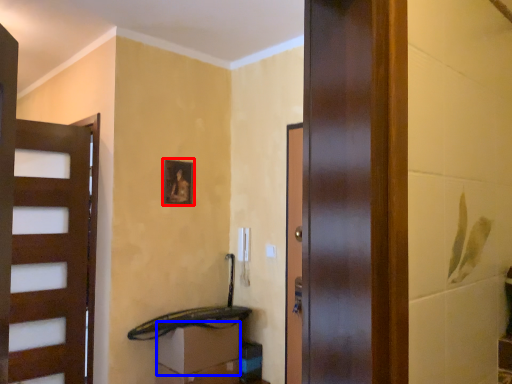
Question: Which point is closer to the camera, picture frame (highlighted by a red box) or drawer (highlighted by a blue box)?

Choices:
 (A) picture frame
 (B) drawer

Answer: (B)